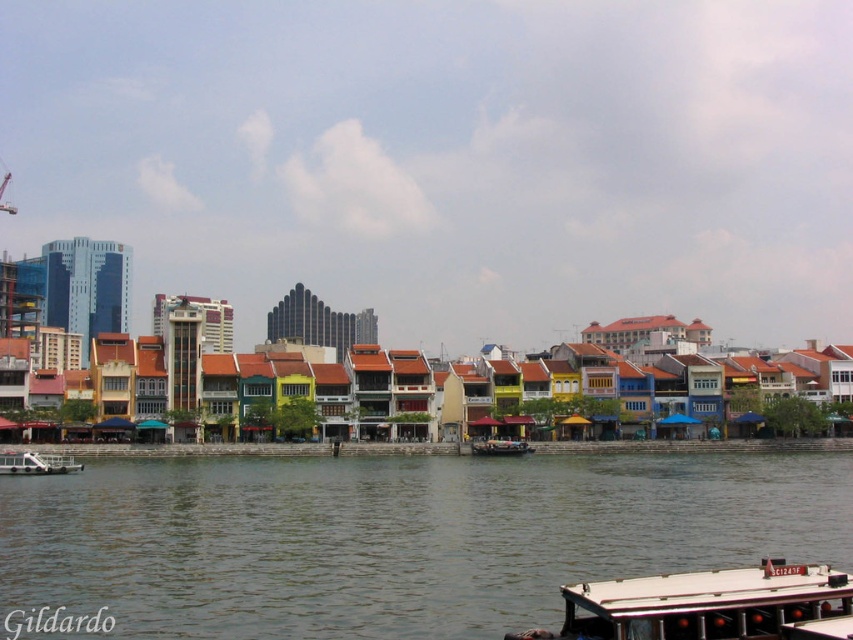
You are standing at the point with coordinates point [396,536]. Based on the scene, what is the color of the area you are currently standing on?

The point [396,536] corresponds to greenish water at lower center, so the area you are standing on is greenish water.